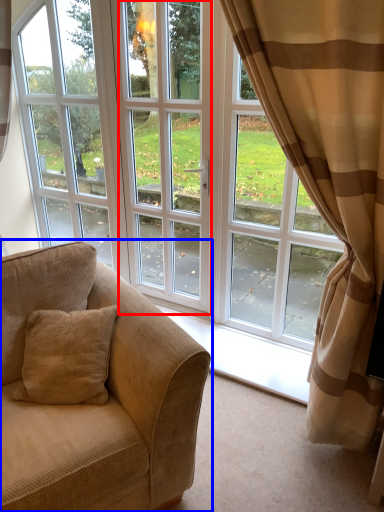
Question: Among these objects, which one is nearest to the camera, screen door (highlighted by a red box) or studio couch (highlighted by a blue box)?

Choices:
 (A) screen door
 (B) studio couch

Answer: (B)